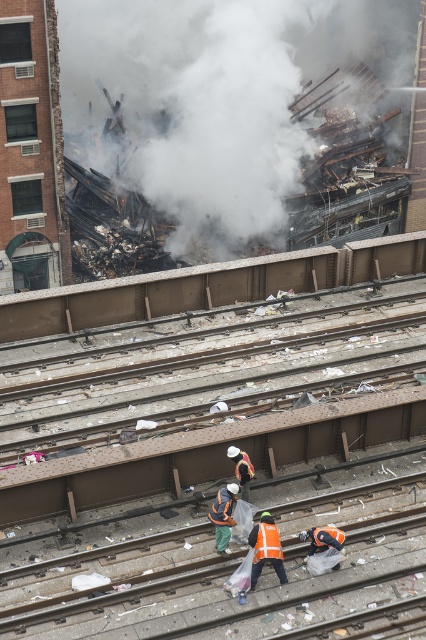
You are a firefighter assessing the scene. You notice the white smoke at upper center and the orange reflective safety vest at lower center. Based on their sizes, which object might indicate a more immediate danger requiring attention?

The white smoke at upper center has a larger width than the orange reflective safety vest at lower center, suggesting it could be a more immediate danger due to its size, so the firefighter should prioritize addressing the white smoke at upper center.

You are a firefighter assessing the scene. You see a point marked at coordinates (218, 93). What does this point represent?

The point at coordinates (218, 93) represents white smoke at upper center.

You are a firefighter assessing the scene. You need to locate the white smoke at upper center. Where exactly is it located in the image?

The white smoke at upper center is located at point coordinates of (x=218, y=93).